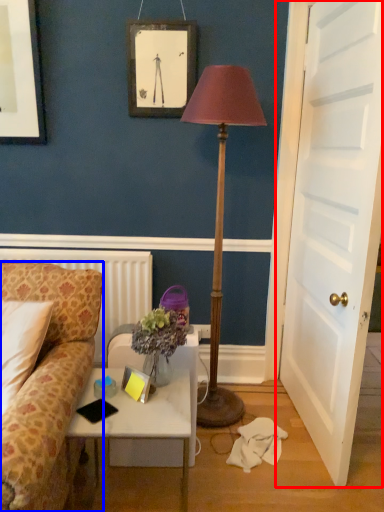
Question: Which of the following is the closest to the observer, door (highlighted by a red box) or studio couch (highlighted by a blue box)?

Choices:
 (A) door
 (B) studio couch

Answer: (A)